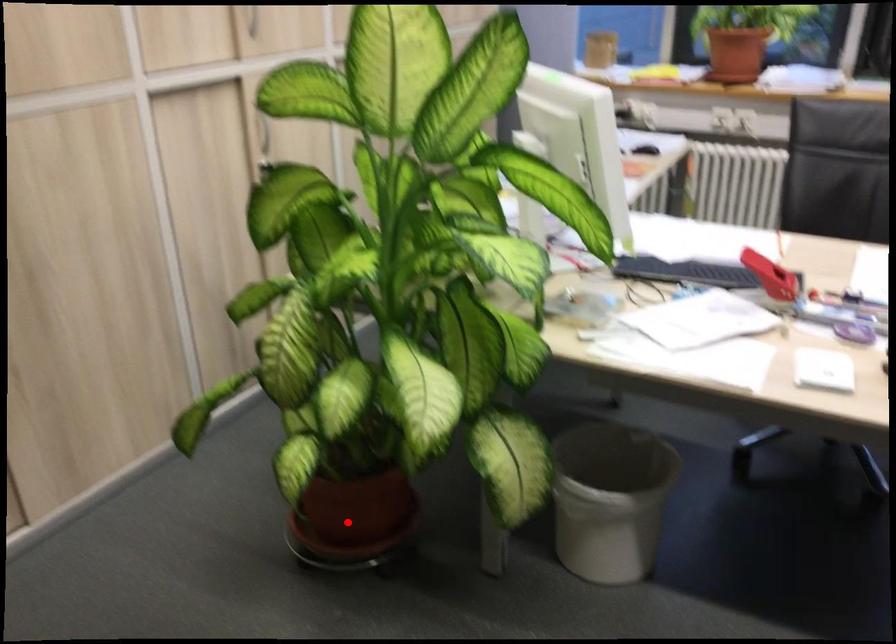
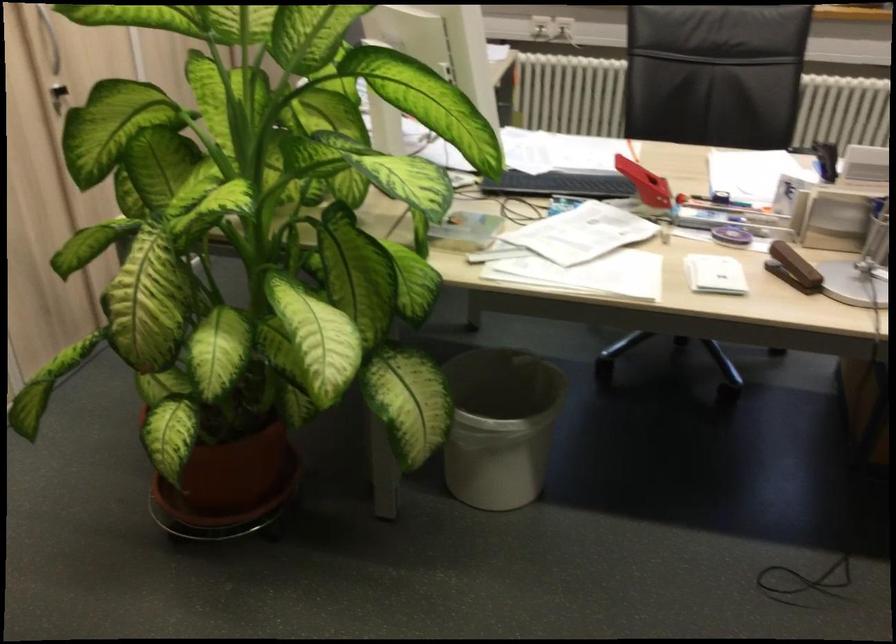
Question: A red point is marked in image1. In image2, is the corresponding 3D point closer to the camera or farther? Reply with the corresponding letter.

Choices:
 (A) The corresponding 3D point is closer.
 (B) The corresponding 3D point is farther.

Answer: (A)